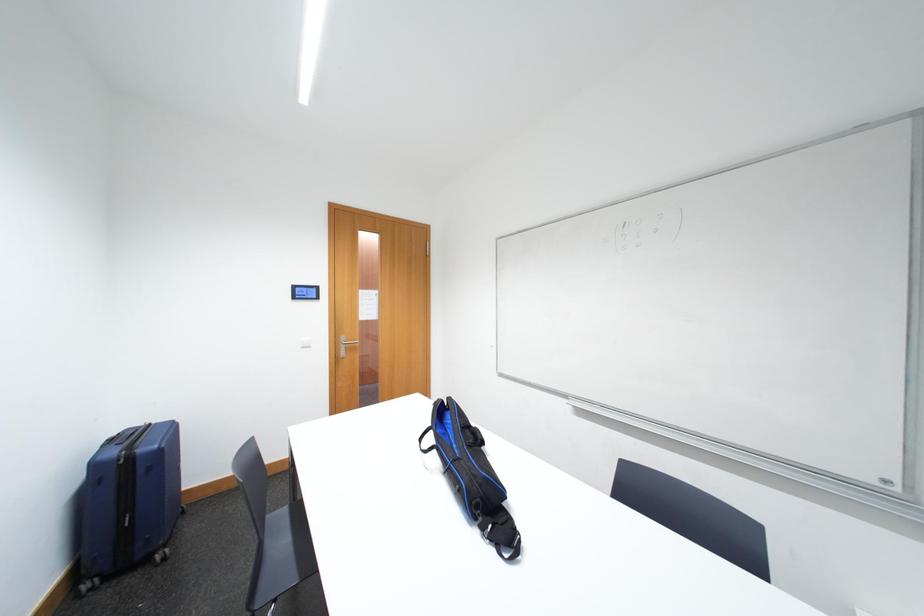
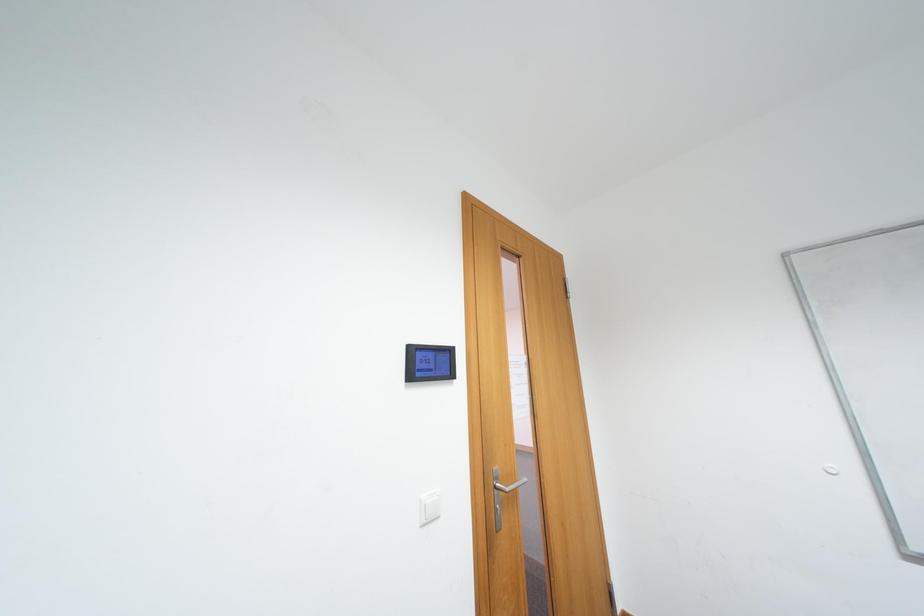
In a continuous first-person perspective shot, in which direction is the camera moving?

The cameraman moved toward left, forward.